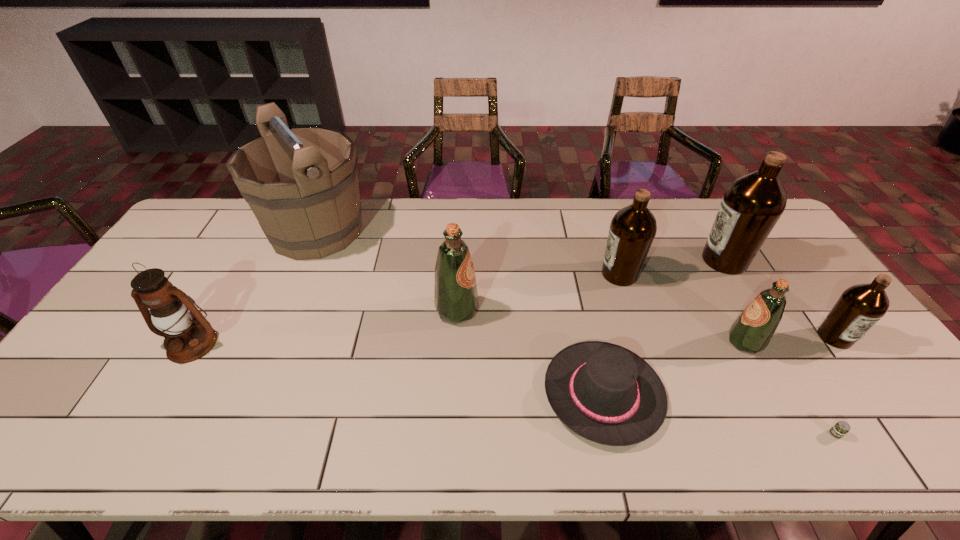
You are a GUI agent. You are given a task and a screenshot of the screen. Output one action in this format:
    pyautogui.click(x=<x>, y=<y>)
    Task: Click on the blank area located on the label of the fourth olive oil from right to left
    
    Given the screenshot: What is the action you would take?
    pyautogui.click(x=491, y=274)

Find the location of `vacant point located 0.350m on the label of the fourth olive oil from right to left`. vacant point located 0.350m on the label of the fourth olive oil from right to left is located at coordinates (487, 274).

Identify the location of vacant space located on the label of the fourth olive oil from right to left. The width and height of the screenshot is (960, 540). (558, 274).

Locate an element on the screen. vacant space located on the side of the lantern, there is a wick adjustment knob is located at coordinates (152, 413).

Identify the location of vacant area located on the front-facing side of the smaller green olive oil. The image size is (960, 540). (657, 342).

Where is `vacant space located on the front-facing side of the smaller green olive oil`? vacant space located on the front-facing side of the smaller green olive oil is located at coordinates (650, 342).

The image size is (960, 540). I want to click on free space located 0.380m on the front-facing side of the smaller green olive oil, so click(x=587, y=342).

Identify the location of vacant region located on the label of the rightmost olive oil. The image size is (960, 540). (888, 410).

The image size is (960, 540). Identify the location of free space located on the right of the second shortest object. (790, 393).

Image resolution: width=960 pixels, height=540 pixels. In order to click on free spot located 0.110m on the right of the beer can in this screenshot , I will do click(897, 434).